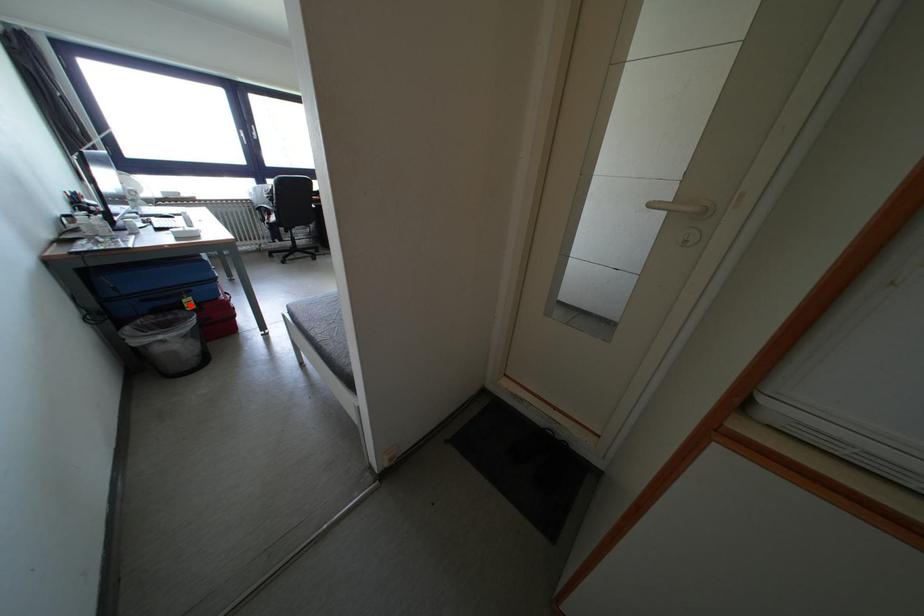
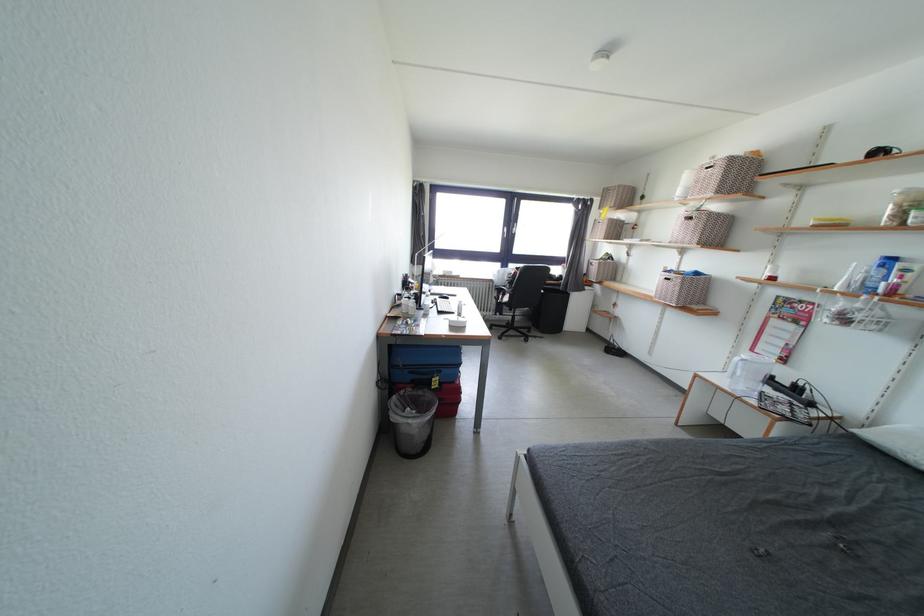
Question: I am providing you with two images of the same scene from different viewpoints. Image1 has a red point marked. In image2, the corresponding 3D location appears at what relative position? Reply with the corresponding letter.

Choices:
 (A) Closer
 (B) Farther

Answer: (B)